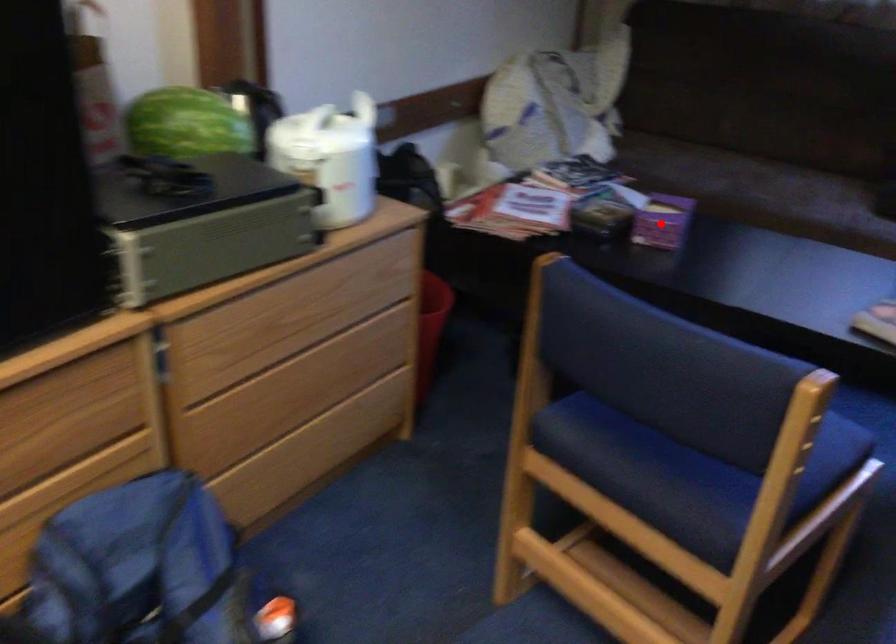
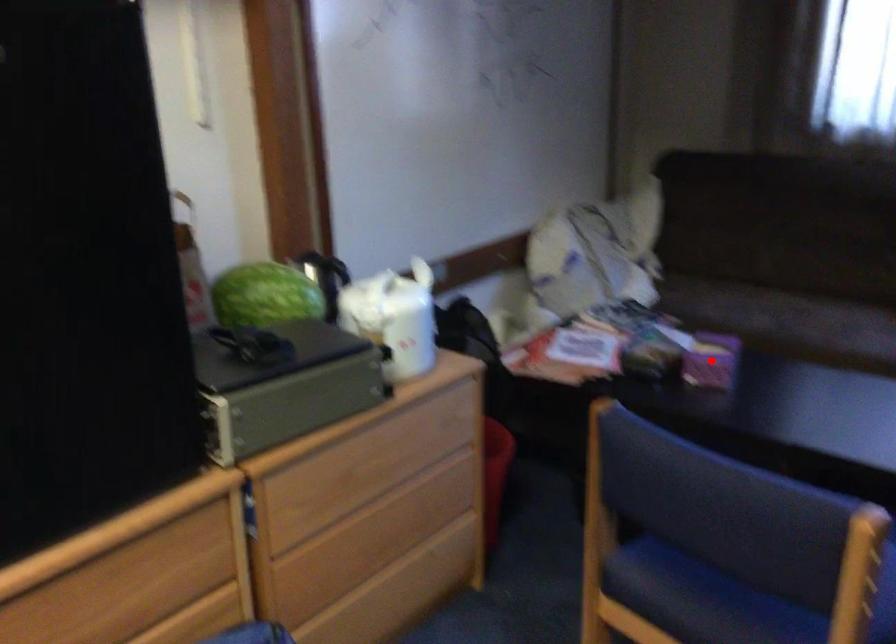
I am providing you with two images of the same scene from different viewpoints. A red point is marked on the first image and another point is marked on the second image. Does the point marked in image1 correspond to the same location as the one in image2?

Yes